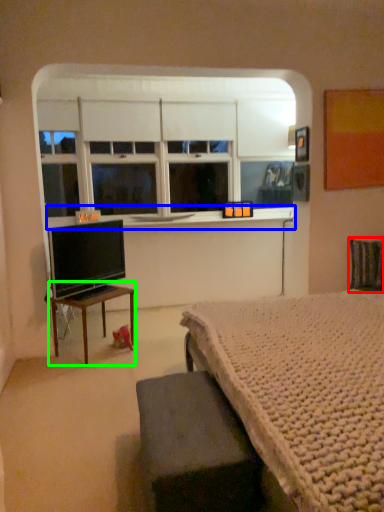
Question: Considering the real-world distances, which object is closest to swivel chair (highlighted by a red box)? window sill (highlighted by a blue box) or table (highlighted by a green box).

Choices:
 (A) window sill
 (B) table

Answer: (A)